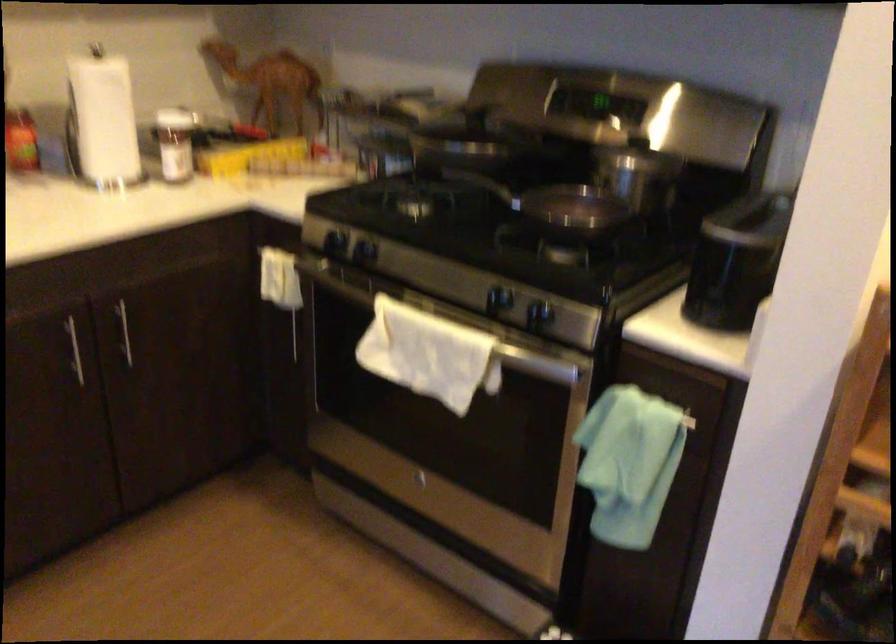
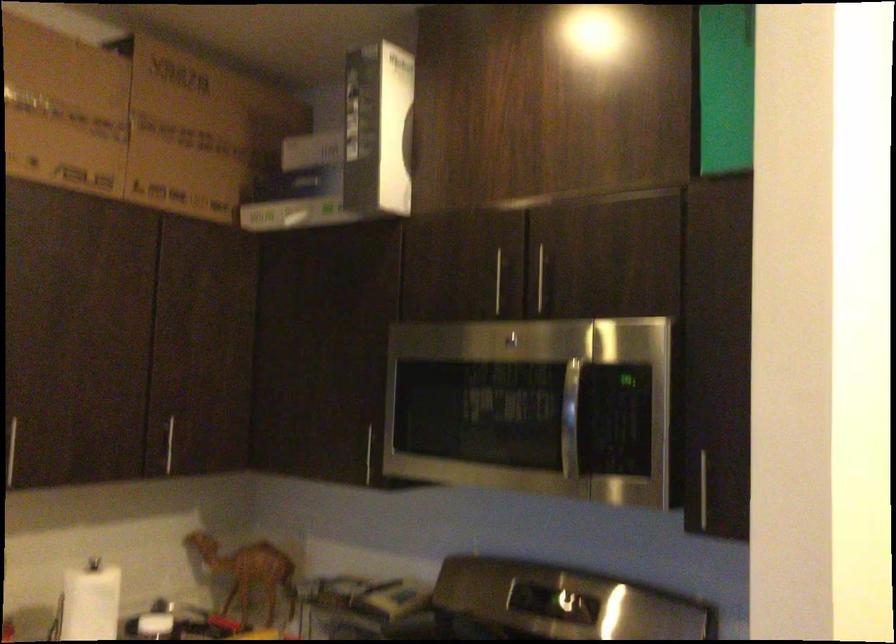
Locate, in the second image, the point that corresponds to (x=102, y=90) in the first image.

(90, 601)